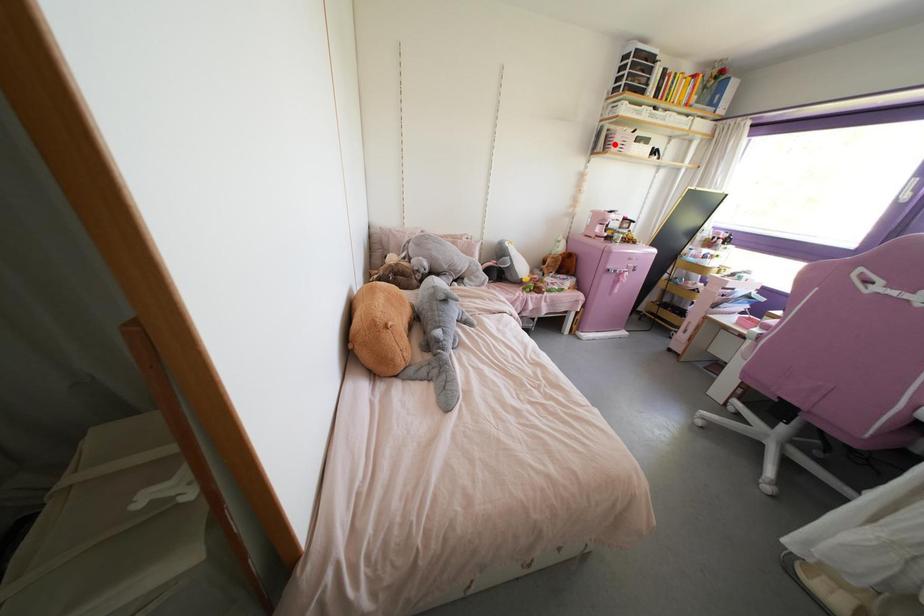
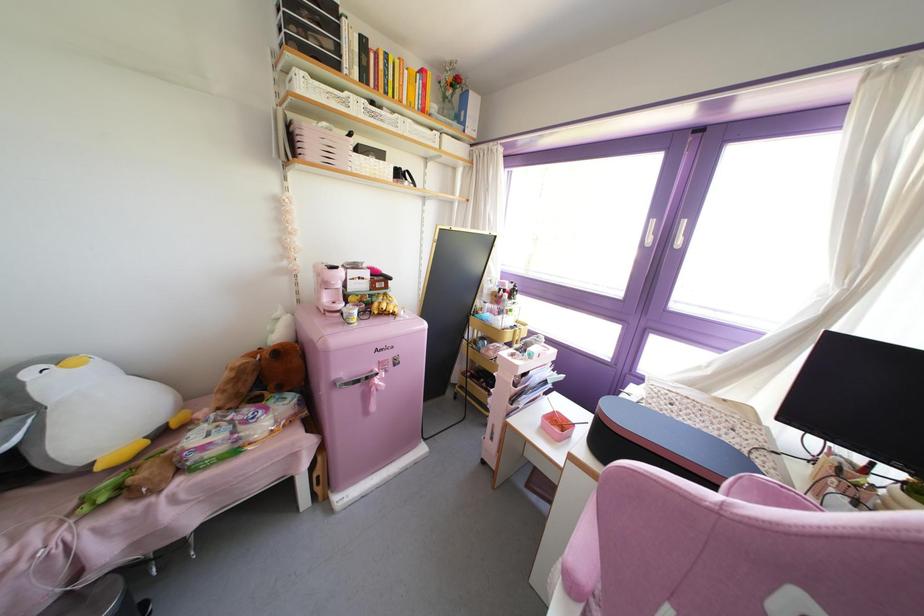
Where in the second image is the point corresponding to the highlighted location from the first image?

(310, 148)